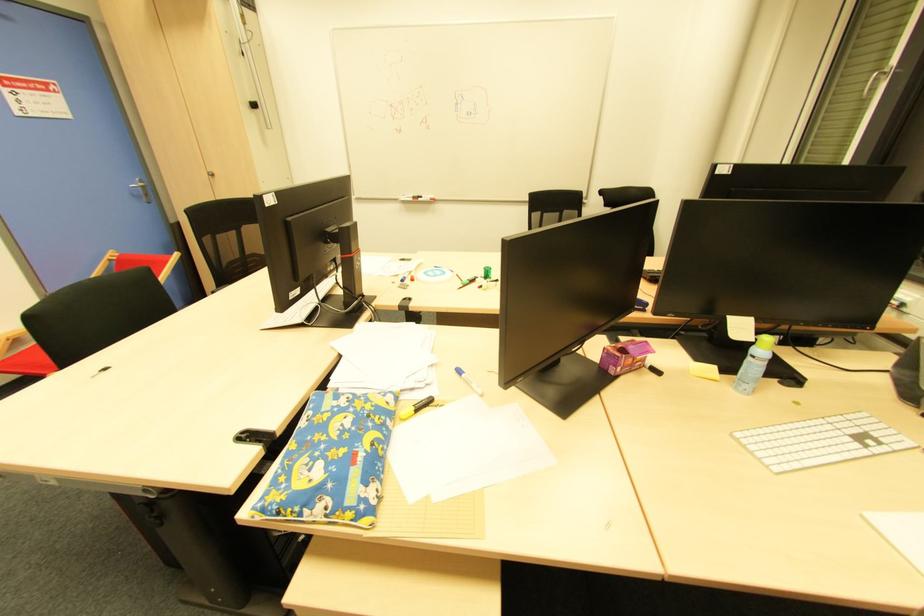
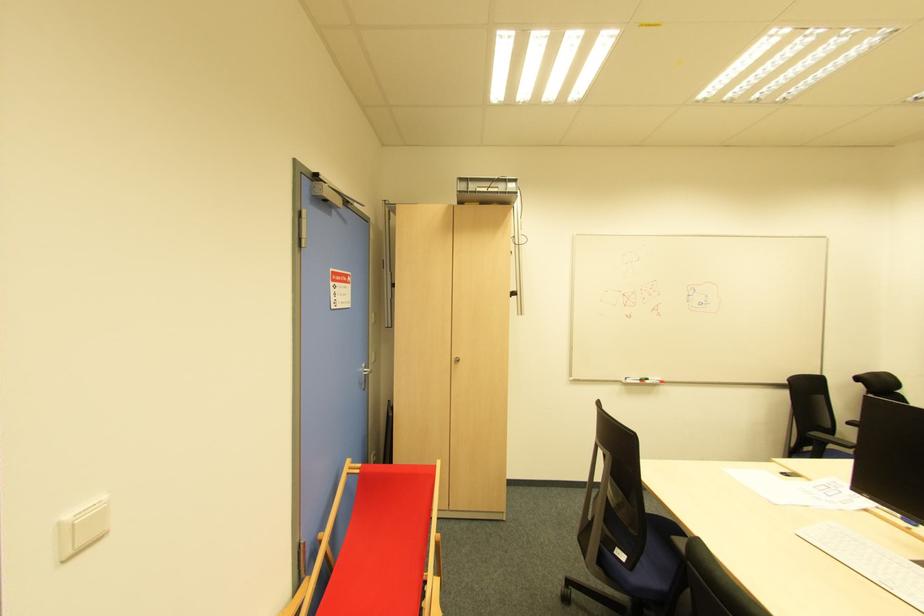
In the second image, find the point that corresponds to point 147,197 in the first image.

(366, 382)